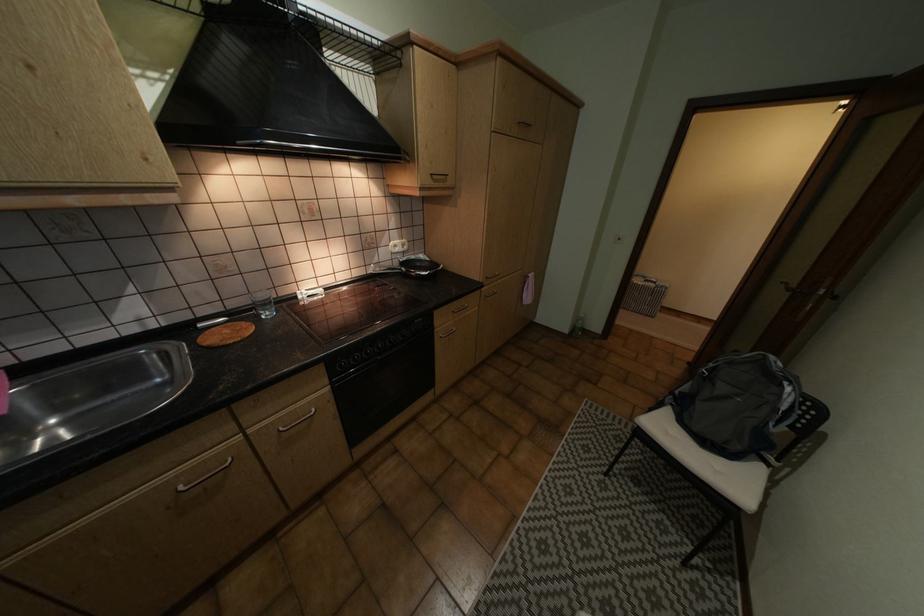
Where would you pull the dark door handle? Please return your answer as a coordinate pair (x, y).

(811, 292)